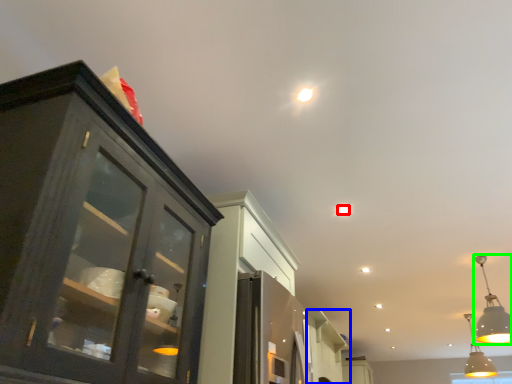
Question: Which object is positioned farthest from light (highlighted by a red box)? Select from cabinetry (highlighted by a blue box) and light fixture (highlighted by a green box).

Choices:
 (A) cabinetry
 (B) light fixture

Answer: (A)